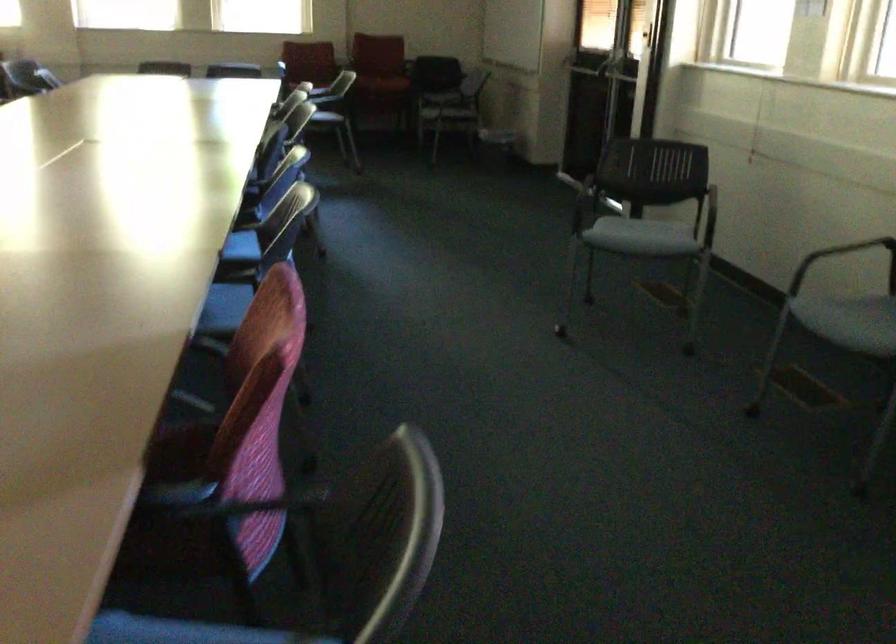
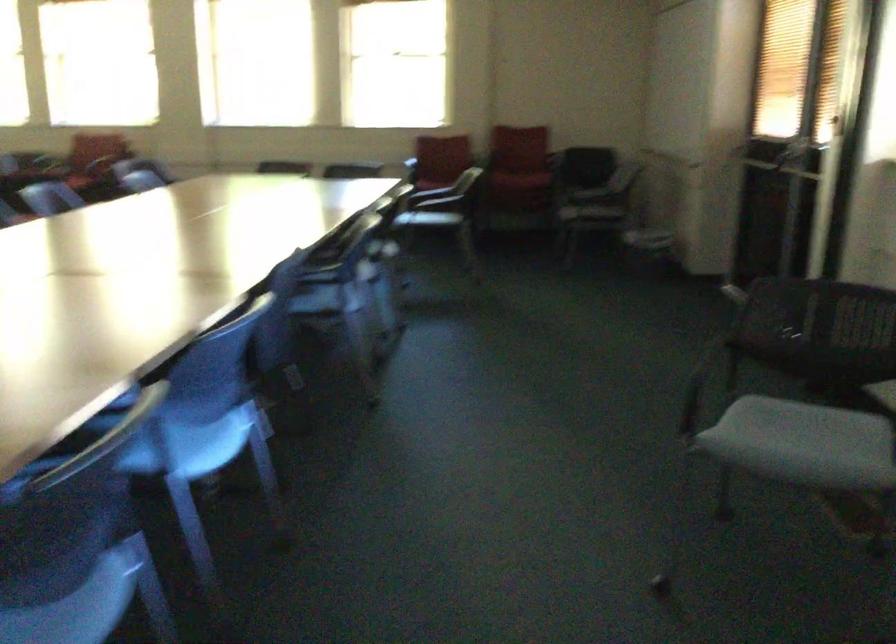
Find the pixel in the second image that matches pixel 389 80 in the first image.

(515, 192)